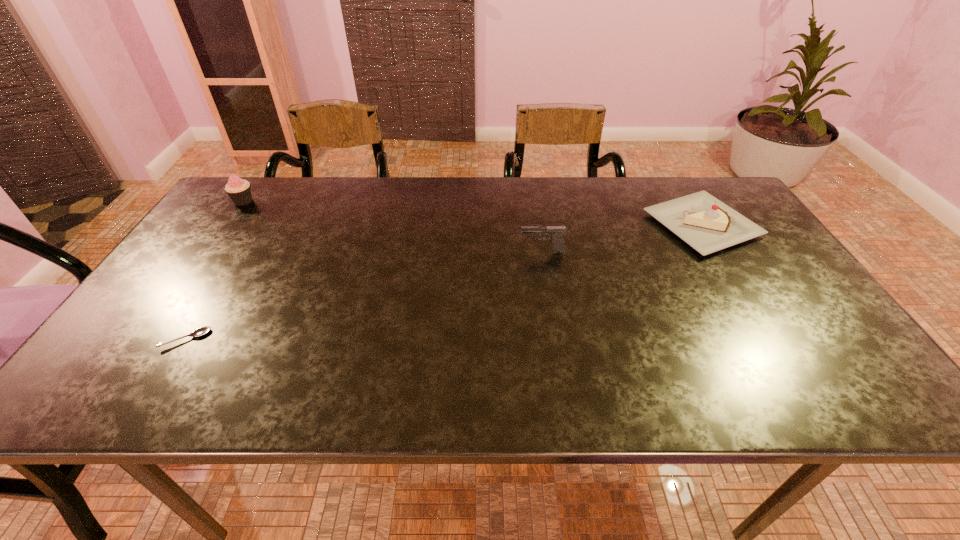
Where is `vacant space that is in between the pistol and the soupspoon`? The height and width of the screenshot is (540, 960). vacant space that is in between the pistol and the soupspoon is located at coordinates (364, 295).

At what (x,y) coordinates should I click in order to perform the action: click on vacant region between the cake and the leftmost object. Please return your answer as a coordinate pair (x, y). The height and width of the screenshot is (540, 960). Looking at the image, I should click on (472, 213).

Identify the location of vacant area that lies between the leftmost object and the rightmost object. The width and height of the screenshot is (960, 540). (472, 213).

You are a GUI agent. You are given a task and a screenshot of the screen. Output one action in this format:
    pyautogui.click(x=<x>, y=<y>)
    Task: Click on the free point between the rightmost object and the third object from right to left
    
    Given the screenshot: What is the action you would take?
    pyautogui.click(x=444, y=282)

Locate an element on the screen. The image size is (960, 540). vacant region between the second object from left to right and the second shortest object is located at coordinates (444, 282).

This screenshot has width=960, height=540. I want to click on object that is the third closest to the pistol, so click(239, 190).

Select which object is the closest to the second object from right to left. Please provide its 2D coordinates. Your answer should be formatted as a tuple, i.e. [(x, y)], where the tuple contains the x and y coordinates of a point satisfying the conditions above.

[(708, 225)]